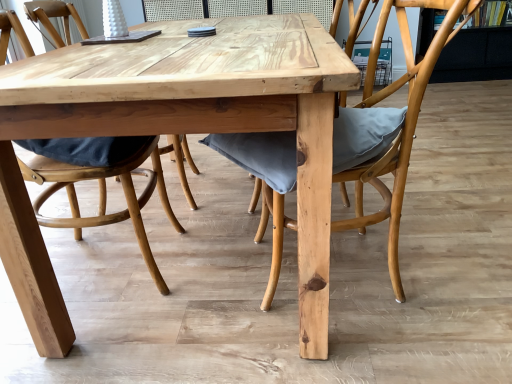
Question: Is matte gray cushion at center, the second chair viewed from the left, wider or thinner than natural wood table at center?

Choices:
 (A) thin
 (B) wide

Answer: (A)

Question: Based on their sizes in the image, would you say matte gray cushion at center, which is the first chair in right-to-left order, is bigger or smaller than natural wood table at center?

Choices:
 (A) big
 (B) small

Answer: (B)

Question: Which is farther from the natural wood table at center?

Choices:
 (A) matte wood chair at center, acting as the second chair starting from the right
 (B) matte gray cushion at center, which is the first chair in right-to-left order

Answer: (A)

Question: Estimate the real-world distances between objects in this image. Which object is closer to the matte wood chair at center, which is counted as the first chair, starting from the left?

Choices:
 (A) natural wood table at center
 (B) matte gray cushion at center, which is the first chair in right-to-left order

Answer: (A)